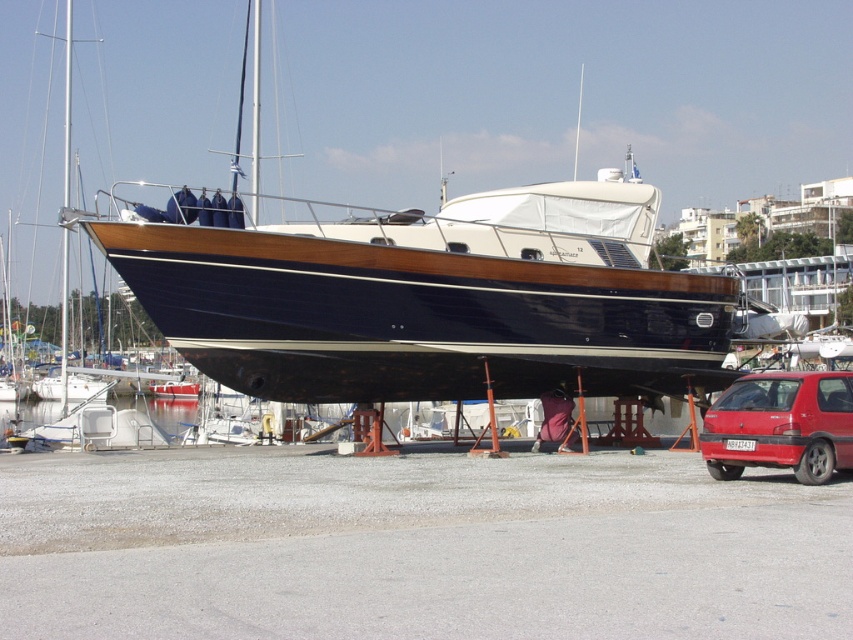
Question: Which of the following is the closest to the observer?

Choices:
 (A) matte red hatchback at lower right
 (B) shiny dark wood boat at center

Answer: (A)

Question: Can you confirm if shiny dark wood boat at center is smaller than matte red hatchback at lower right?

Choices:
 (A) no
 (B) yes

Answer: (A)

Question: Is shiny dark wood boat at center positioned behind matte red hatchback at lower right?

Choices:
 (A) no
 (B) yes

Answer: (B)

Question: Which of the following is the closest to the observer?

Choices:
 (A) (798, 392)
 (B) (531, 273)

Answer: (A)

Question: Can you confirm if shiny dark wood boat at center is positioned to the left of matte red hatchback at lower right?

Choices:
 (A) no
 (B) yes

Answer: (B)